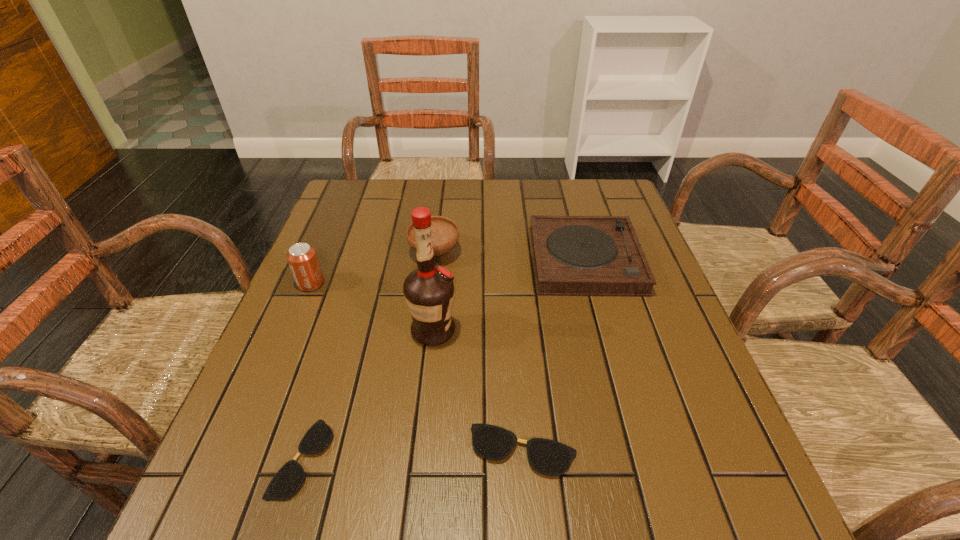
The height and width of the screenshot is (540, 960). I want to click on free spot at the far edge of the desktop, so click(x=471, y=195).

Locate an element on the screen. free space at the near edge of the desktop is located at coordinates (396, 427).

In the image, there is a desktop. In order to click on vacant space at the right edge in this screenshot , I will do `click(608, 325)`.

Find the location of a particular element. free space at the far left corner is located at coordinates (375, 205).

This screenshot has height=540, width=960. What are the coordinates of `vacant area at the near left corner` in the screenshot? It's located at (260, 459).

The image size is (960, 540). Identify the location of free space at the far right corner of the desktop. (568, 183).

What are the coordinates of `free location at the near right corner` in the screenshot? It's located at (725, 418).

Find the location of `empty location between the fourth shortest object and the third shortest object`. empty location between the fourth shortest object and the third shortest object is located at coordinates (510, 256).

Locate an element on the screen. Image resolution: width=960 pixels, height=540 pixels. free space between the taller spectacles and the third nearest object is located at coordinates (478, 390).

You are a GUI agent. You are given a task and a screenshot of the screen. Output one action in this format:
    pyautogui.click(x=<x>, y=<y>)
    Task: Click on the blank region between the taller spectacles and the phonograph record
    This screenshot has height=540, width=960.
    Given the screenshot: What is the action you would take?
    pyautogui.click(x=554, y=355)